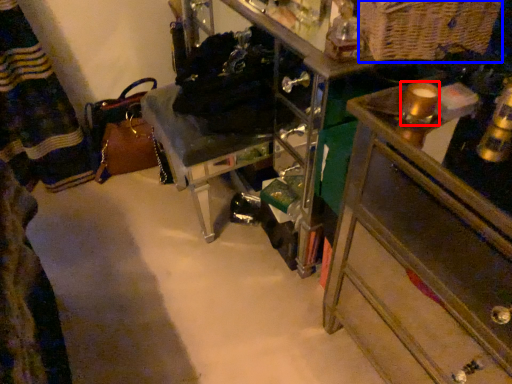
Question: Which object appears closest to the camera in this image, beverage (highlighted by a red box) or basket (highlighted by a blue box)?

Choices:
 (A) beverage
 (B) basket

Answer: (A)